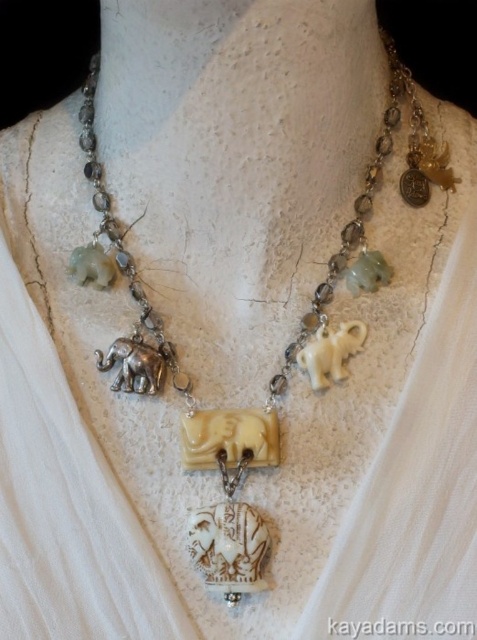
You are a jeweler who wants to place the white ivory elephant at center into a display case that is 1 meter wide. Will the elephant fit in the case?

The white ivory elephant at center is 1.12 meters wide, which is wider than the 1 meter wide display case. It will not fit.